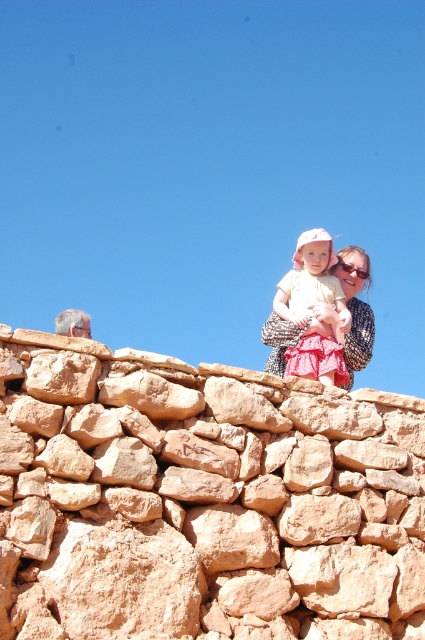
You are standing at the base of the rustic stone wall at upper center and want to throw a small ball to someone wearing the matte pink dress at upper center. Given that the ball can travel a maximum distance of 35 feet, will it reach the person?

The rustic stone wall at upper center is 36.60 feet from the matte pink dress at upper center. Since the ball can only travel 35 feet, it won not reach the person.

You are a photographer trying to capture the rustic stone wall at upper center and the matte pink dress at upper center in the same frame. Based on their sizes, which object should you focus on first to ensure both are in the frame?

The rustic stone wall at upper center is smaller than the matte pink dress at upper center, so you should focus on the matte pink dress at upper center first to ensure both fit in the frame.